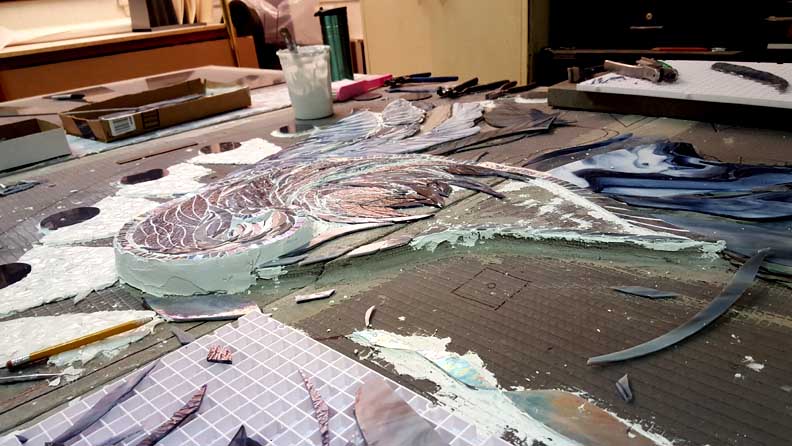
At what (x,y) coordinates should I click in order to perform the action: click on wall. Please return your answer as a coordinate pair (x, y). The height and width of the screenshot is (446, 792). Looking at the image, I should click on (459, 23), (417, 23).